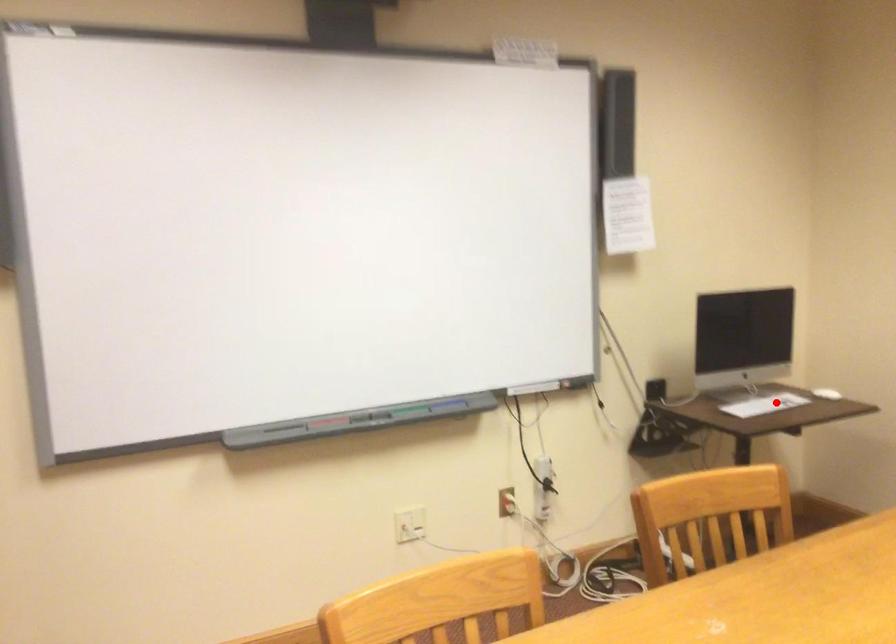
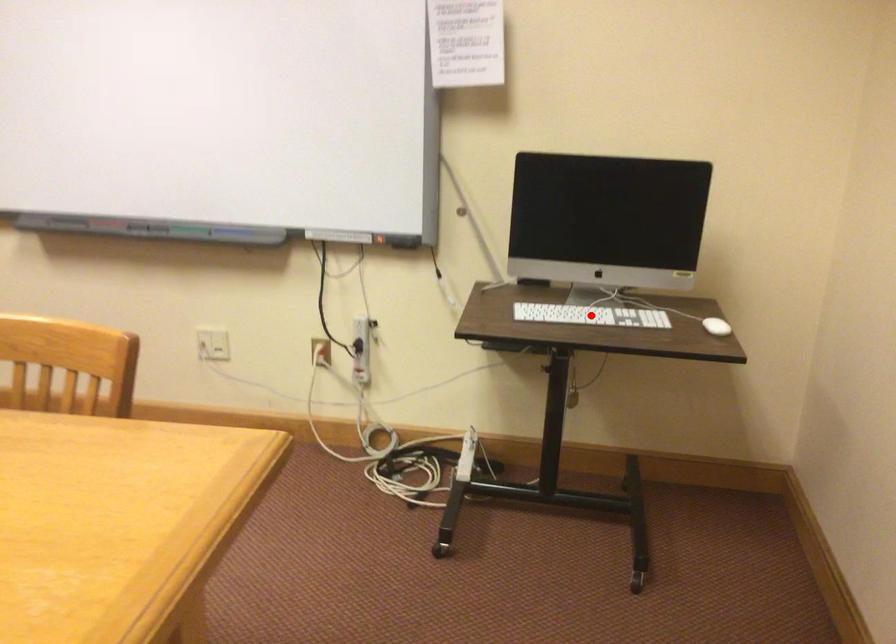
I am providing you with two images of the same scene from different viewpoints. A red point is marked on the first image and another point is marked on the second image. Does the point marked in image1 correspond to the same location as the one in image2?

Yes